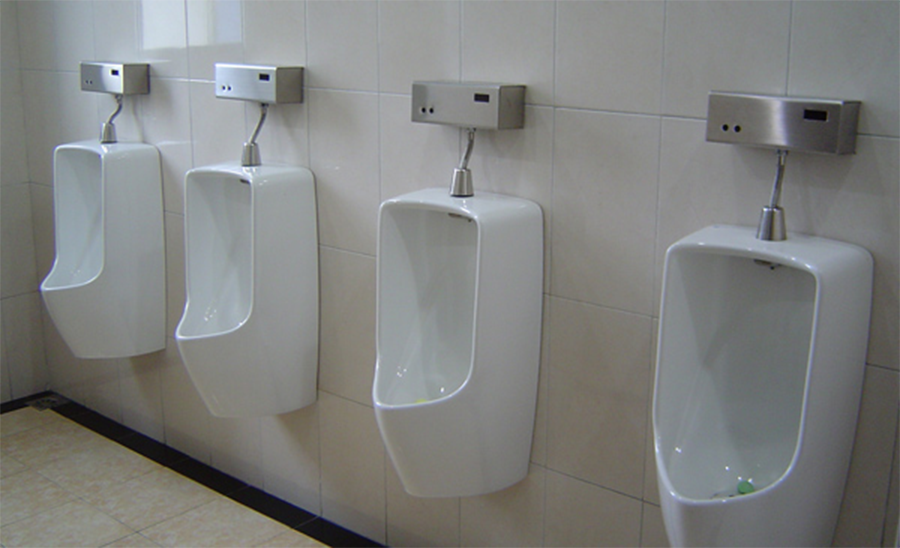
Identify the location of urinals. Image resolution: width=900 pixels, height=548 pixels. (99, 219), (288, 262), (488, 319), (808, 388).